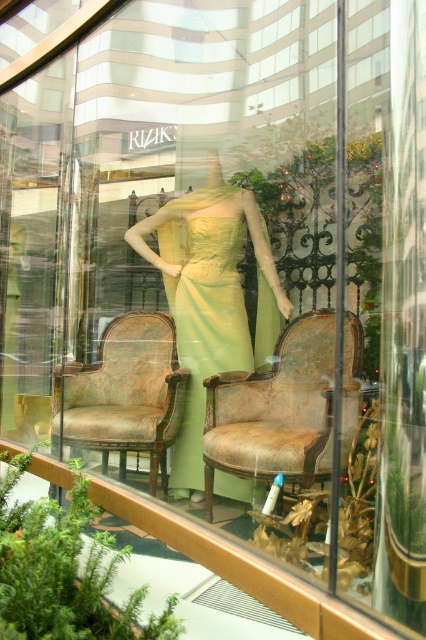
Question: Which point appears closest to the camera in this image?

Choices:
 (A) (224, 305)
 (B) (161, 406)
 (C) (313, 417)
 (D) (210, 260)

Answer: (C)

Question: Which of these objects is positioned farthest from the distressed leather armchair at left?

Choices:
 (A) distressed leather armchair at center
 (B) lime green satin dress at center
 (C) matte yellow dress at center

Answer: (A)

Question: Is the position of distressed leather armchair at center less distant than that of distressed leather armchair at left?

Choices:
 (A) no
 (B) yes

Answer: (B)

Question: Is distressed leather armchair at center smaller than lime green satin dress at center?

Choices:
 (A) yes
 (B) no

Answer: (B)

Question: Estimate the real-world distances between objects in this image. Which object is farther from the lime green satin dress at center?

Choices:
 (A) distressed leather armchair at left
 (B) matte yellow dress at center
 (C) distressed leather armchair at center

Answer: (C)

Question: Can you confirm if matte yellow dress at center is positioned to the right of distressed leather armchair at left?

Choices:
 (A) no
 (B) yes

Answer: (B)